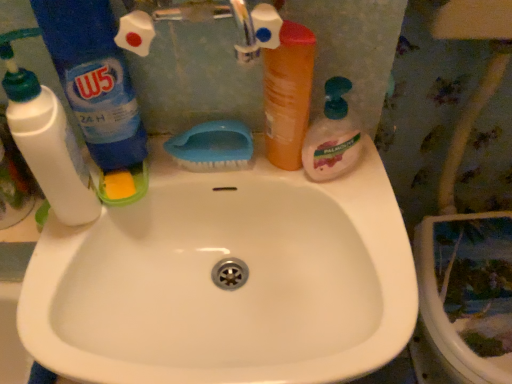
At what (x,y) coordinates should I click in order to perform the action: click on vacant point to the right of blue plastic brush at upper center. Please return your answer as a coordinate pair (x, y). The image size is (512, 384). Looking at the image, I should click on click(x=313, y=185).